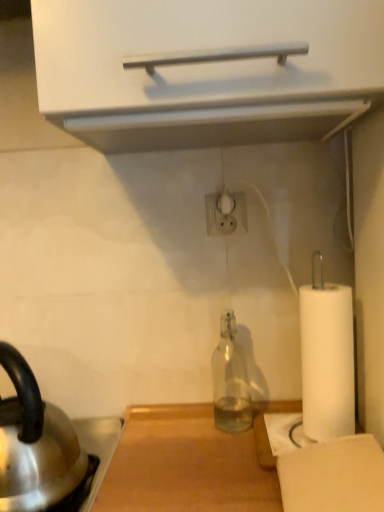
Question: Is transparent glass bottle at center oriented away from shiny metallic kettle at lower left?

Choices:
 (A) no
 (B) yes

Answer: (A)

Question: Is transparent glass bottle at center shorter than shiny metallic kettle at lower left?

Choices:
 (A) no
 (B) yes

Answer: (B)

Question: Considering the relative positions of transparent glass bottle at center and shiny metallic kettle at lower left in the image provided, is transparent glass bottle at center to the right of shiny metallic kettle at lower left from the viewer's perspective?

Choices:
 (A) no
 (B) yes

Answer: (B)

Question: From the image's perspective, is transparent glass bottle at center on shiny metallic kettle at lower left?

Choices:
 (A) yes
 (B) no

Answer: (A)

Question: Is transparent glass bottle at center not within shiny metallic kettle at lower left?

Choices:
 (A) yes
 (B) no

Answer: (A)

Question: From a real-world perspective, is transparent glass bottle at center physically above shiny metallic kettle at lower left?

Choices:
 (A) no
 (B) yes

Answer: (A)

Question: Can you confirm if shiny metallic kettle at lower left is taller than transparent glass bottle at center?

Choices:
 (A) no
 (B) yes

Answer: (B)

Question: Is shiny metallic kettle at lower left closer to camera compared to transparent glass bottle at center?

Choices:
 (A) yes
 (B) no

Answer: (A)

Question: From the image's perspective, is shiny metallic kettle at lower left located beneath transparent glass bottle at center?

Choices:
 (A) no
 (B) yes

Answer: (B)

Question: Does shiny metallic kettle at lower left have a larger size compared to transparent glass bottle at center?

Choices:
 (A) no
 (B) yes

Answer: (B)

Question: From a real-world perspective, is shiny metallic kettle at lower left physically below transparent glass bottle at center?

Choices:
 (A) no
 (B) yes

Answer: (A)

Question: Is shiny metallic kettle at lower left oriented away from transparent glass bottle at center?

Choices:
 (A) no
 (B) yes

Answer: (B)

Question: From a real-world perspective, is transparent glass bottle at center positioned above or below shiny metallic kettle at lower left?

Choices:
 (A) below
 (B) above

Answer: (A)